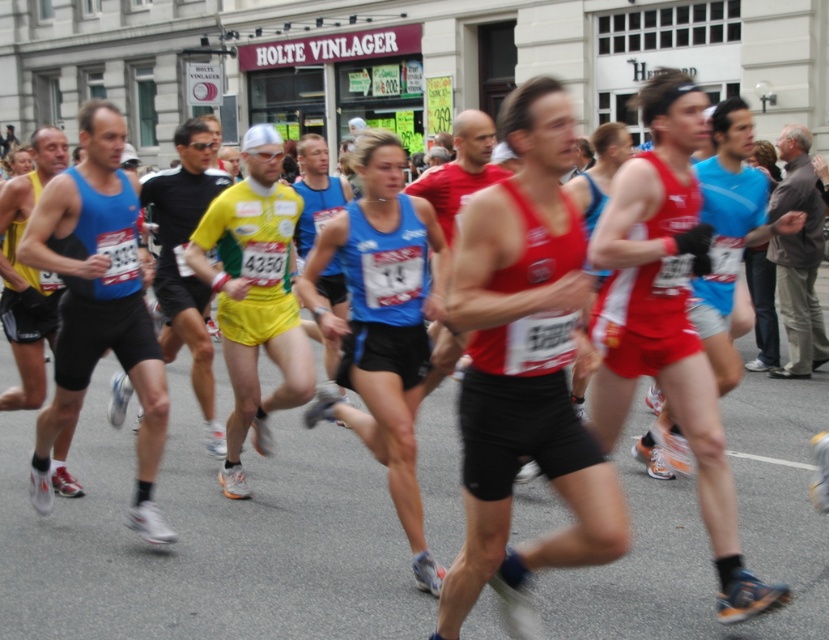
You are a photographer standing at the starting line of the marathon. You want to capture a closeup shot of the matte red tank top at center. Considering the camera you have can focus on subjects within 10 feet, will you be able to take the photo?

The matte red tank top at center is 10.05 feet away from the camera. Since the camera can focus within 10 feet, the distance is slightly beyond the focus range. Therefore, the photographer cannot take a clear closeup shot.

You are a spectator watching the marathon runners. You see the matte red tank top at center and the matte blue tank top at left. Which runner is closer to the finish line?

The matte red tank top at center is in front of the matte blue tank top at left, so the runner in the matte red tank top at center is closer to the finish line.

You are a photographer standing at the starting line of the marathon. You want to capture a photo that includes both the point at coordinates point (129, 513) and the point at coordinates point (714, 317). Which point will appear closer to the edge of the photo frame?

Point (129, 513) is closer to the camera than point (714, 317). Therefore, in the photo frame, point (714, 317) will be closer to the edge of the photo frame because it is farther away from the camera.